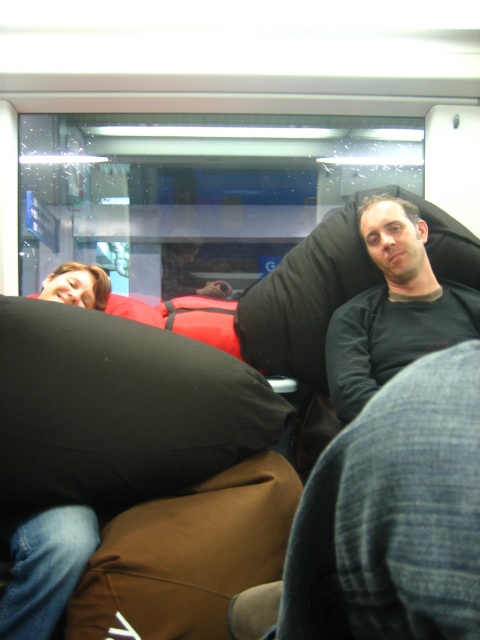
You are standing in the train and want to place a small bag on the seat. The seat has a coordinate system where the bottom left corner is the origin. The black fabric pillow at left is at point (118, 408). Where should you place the bag so it doesn

The black fabric pillow at left is located at point (118, 408). To place the bag safely, ensure it doesn

You are a passenger on a train and want to place your backpack on the seat next to you. The seat has the black fabric pillow at left and the brown fabric bean bag chair at center. Which object should you place your backpack on if you want it to be closer to the floor?

The brown fabric bean bag chair at center is lower than the black fabric pillow at left, so placing the backpack on the brown fabric bean bag chair at center would make it closer to the floor.

You are a passenger on the train and want to place a small bag between the two points marked as point 1 at point (x=214, y=477) and point 2 at point (x=374, y=362). Which point should you place it closer to so that it stays in front of point 2?

You should place the bag closer to point 1 at point (x=214, y=477) because it is in front of point 2 at point (x=374, y=362). This ensures the bag stays in front of point 2.